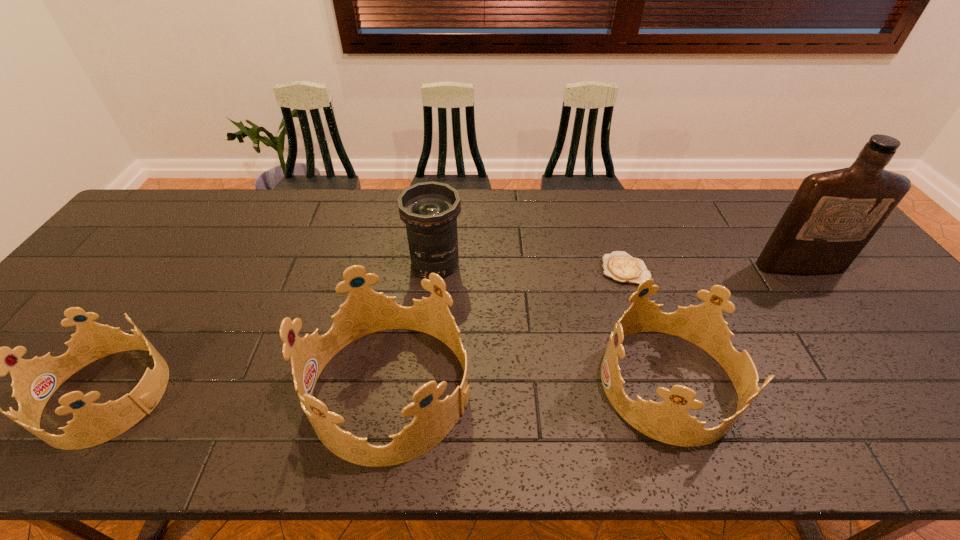
The height and width of the screenshot is (540, 960). Identify the location of free point that keeps the tiaras evenly spaced on the right. (940, 377).